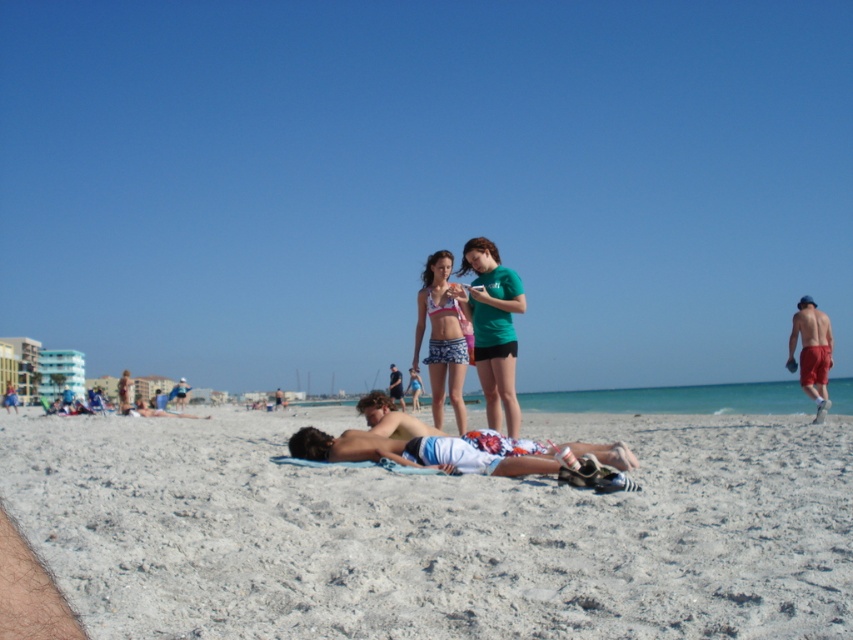
Who is lower down, green matte t-shirt at center or smooth tan skin at center?

Positioned lower is smooth tan skin at center.

Which is more to the right, green matte t-shirt at center or smooth tan skin at center?

green matte t-shirt at center

The image size is (853, 640). I want to click on green matte t-shirt at center, so click(492, 328).

Who is shorter, red fabric shorts at right or smooth tan skin at center?

smooth tan skin at center

Is point (830, 337) farther from viewer compared to point (389, 368)?

No, (830, 337) is closer to viewer.

Is point (815, 396) less distant than point (389, 381)?

Yes, it is.

Image resolution: width=853 pixels, height=640 pixels. I want to click on red fabric shorts at right, so click(811, 353).

Who is more forward, (440,320) or (184,394)?

Point (440,320) is more forward.

The image size is (853, 640). What do you see at coordinates (440, 339) in the screenshot?
I see `matte pink bikini top at center` at bounding box center [440, 339].

Which is in front, point (426, 312) or point (180, 404)?

Point (426, 312) is in front.

Image resolution: width=853 pixels, height=640 pixels. In order to click on matte pink bikini top at center in this screenshot , I will do `click(440, 339)`.